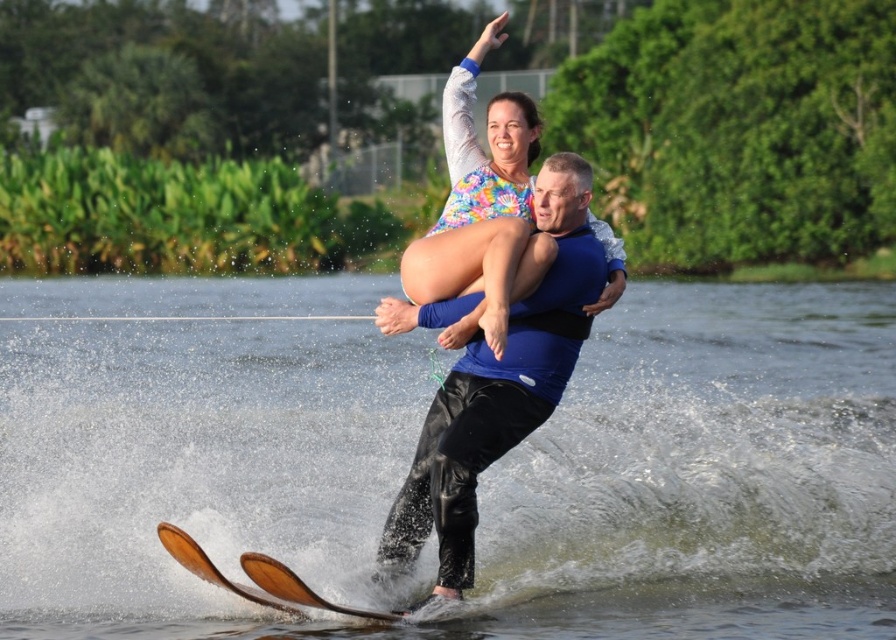
Can you confirm if clear water at skis center is thinner than brown wood water ski at lower center?

In fact, clear water at skis center might be wider than brown wood water ski at lower center.

Between point (851, 547) and point (266, 596), which one is positioned in front?

Point (266, 596) is more forward.

The height and width of the screenshot is (640, 896). Find the location of `clear water at skis center`. clear water at skis center is located at coordinates (705, 474).

Can you confirm if clear water at skis center is thinner than blue matte life vest at center?

No.

This screenshot has width=896, height=640. I want to click on clear water at skis center, so click(705, 474).

At what (x,y) coordinates should I click in order to perform the action: click on clear water at skis center. Please return your answer as a coordinate pair (x, y). This screenshot has width=896, height=640. Looking at the image, I should click on (705, 474).

Is clear water at skis center below brown matte ski at lower center?

Actually, clear water at skis center is above brown matte ski at lower center.

Does clear water at skis center have a greater width compared to brown matte ski at lower center?

Yes, clear water at skis center is wider than brown matte ski at lower center.

You are a GUI agent. You are given a task and a screenshot of the screen. Output one action in this format:
    pyautogui.click(x=<x>, y=<y>)
    Task: Click on the clear water at skis center
    
    Given the screenshot: What is the action you would take?
    pyautogui.click(x=705, y=474)

At what (x,y) coordinates should I click in order to perform the action: click on clear water at skis center. Please return your answer as a coordinate pair (x, y). This screenshot has width=896, height=640. Looking at the image, I should click on (705, 474).